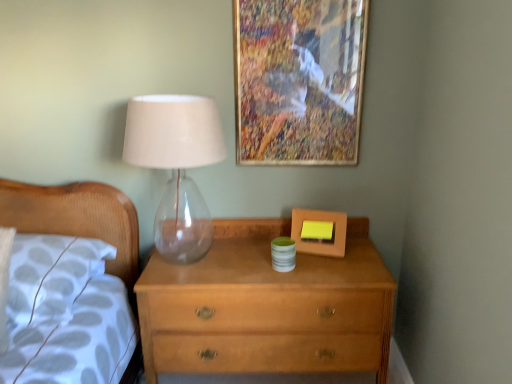
You are a GUI agent. You are given a task and a screenshot of the screen. Output one action in this format:
    pyautogui.click(x=<x>, y=<y>)
    Task: Click on the vacant area in front of matte wooden picture frame at center, which is counted as the first picture frame, starting from the bottom
    
    Given the screenshot: What is the action you would take?
    pyautogui.click(x=338, y=264)